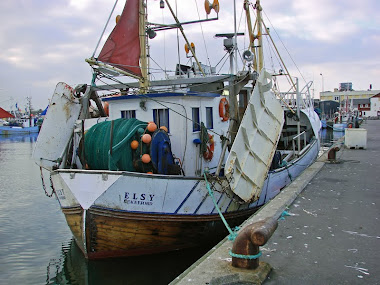
Where is `windows`? windows is located at coordinates (129, 114), (162, 117), (195, 112), (207, 115).